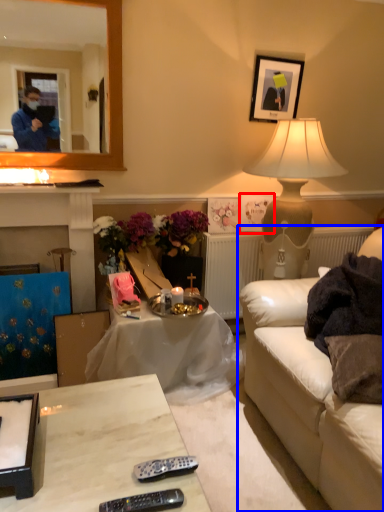
Question: Which object appears farthest to the camera in this image, picture frame (highlighted by a red box) or studio couch (highlighted by a blue box)?

Choices:
 (A) picture frame
 (B) studio couch

Answer: (A)